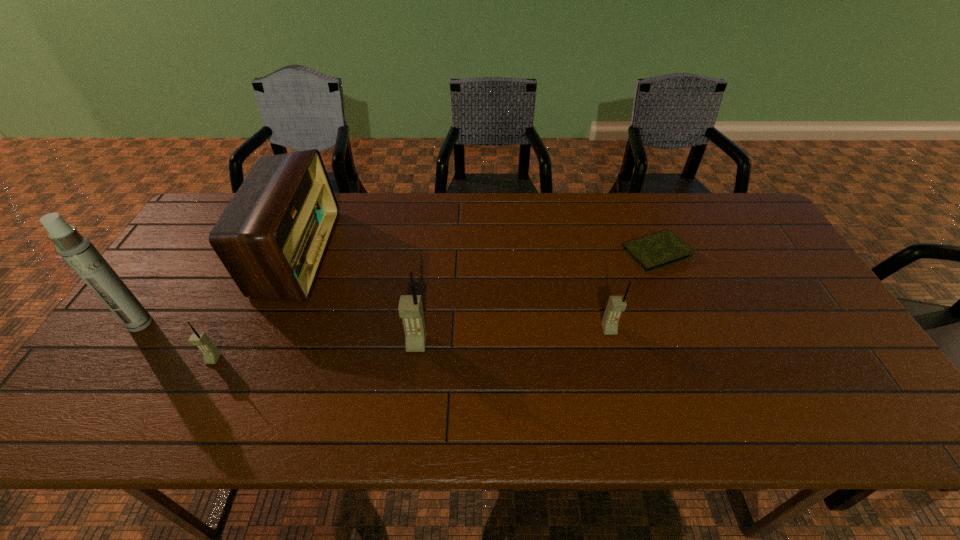
The width and height of the screenshot is (960, 540). Find the location of `the tallest object`. the tallest object is located at coordinates (77, 250).

The width and height of the screenshot is (960, 540). What are the coordinates of `free space located on the front of the second shortest object, where the keypad is located` in the screenshot? It's located at (198, 391).

Identify the location of vacant point located on the front of the tallest cellular telephone, where the keypad is located. click(x=412, y=382).

In order to click on vacant position located on the front of the second tallest cellular telephone, where the keypad is located in this screenshot , I will do `click(614, 352)`.

Find the location of a particular element. blank area located 0.250m on the right of the diary is located at coordinates (774, 253).

This screenshot has height=540, width=960. I want to click on vacant region located 0.240m on the front-facing side of the radio receiver, so click(406, 253).

Find the location of a particular element. free spot located on the right of the aerosol can is located at coordinates (282, 323).

At what (x,y) coordinates should I click in order to perform the action: click on diary at the far edge. Please return your answer as a coordinate pair (x, y). The height and width of the screenshot is (540, 960). Looking at the image, I should click on point(656,251).

Identify the location of radio receiver that is at the far edge. This screenshot has width=960, height=540. (272, 237).

The height and width of the screenshot is (540, 960). In order to click on object that is positioned at the near edge in this screenshot , I will do `click(211, 354)`.